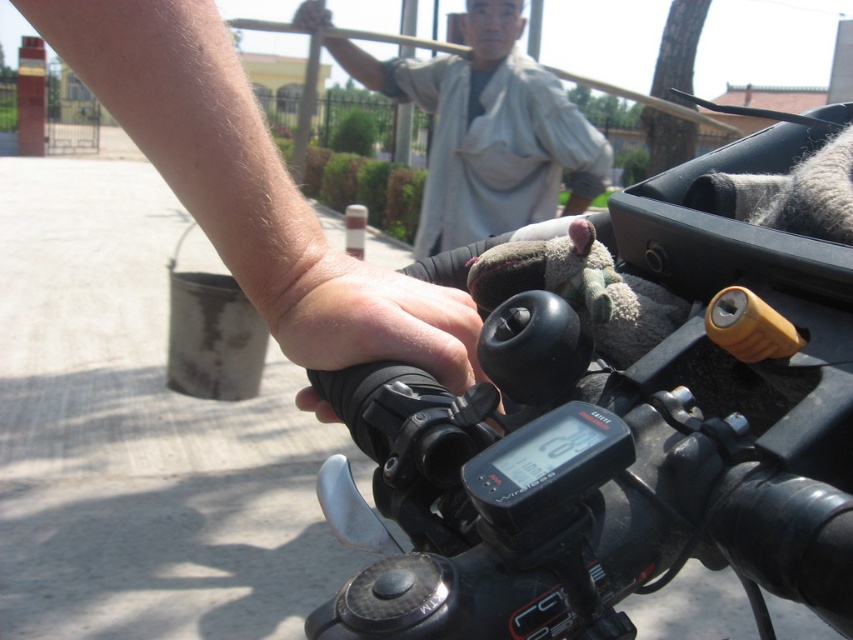
You are riding a motorcycle and want to place a small keychain exactly at the point marked by coordinates point [621,416]. Based on the scene description, where on the motorcycle would this keychain be placed?

The point [621,416] is on the black rubber handlebar at center, so placing the keychain there would position it on the handlebar.

You are riding a motorcycle and looking at the dashboard. There are two points marked on the dashboard display at coordinates point (451, 588) and point (128, 84). Which point is closer to you?

Point (451, 588) is closer to the camera than point (128, 84).